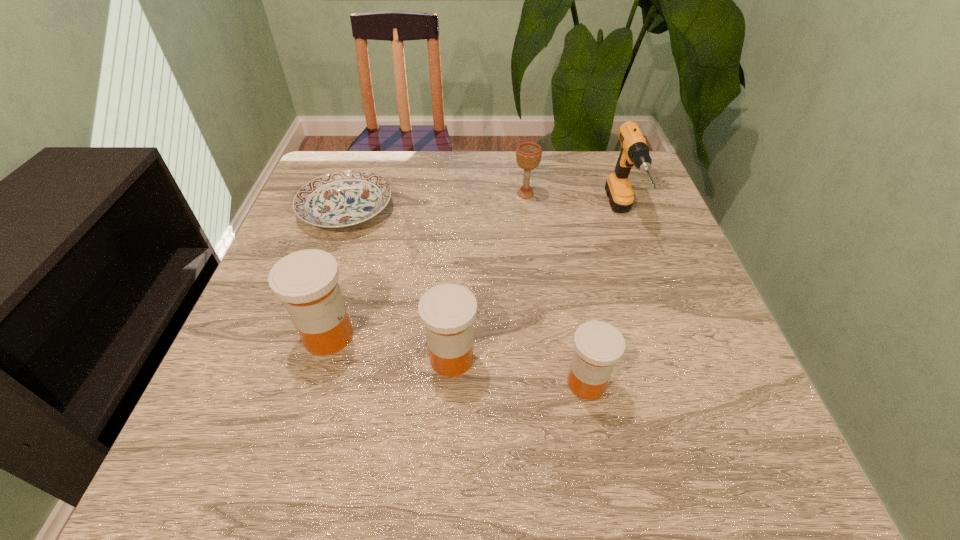
Given the evenly spaced medicines in the image, where should an extra medicine be added on the right to preserve the spacing? Please point to a vacant space. Please provide its 2D coordinates. Your answer should be formatted as a tuple, i.e. [(x, y)], where the tuple contains the x and y coordinates of a point satisfying the conditions above.

[(733, 410)]